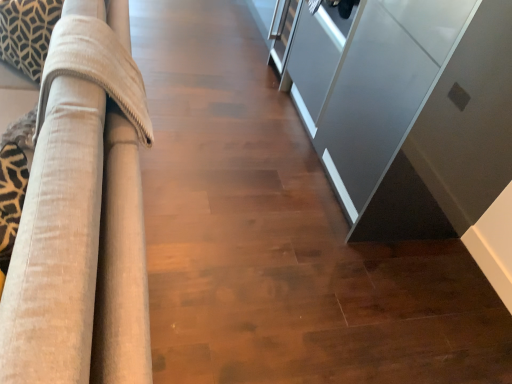
Question: Is patterned fabric pillow at upper left in front of or behind beige fabric couch at left in the image?

Choices:
 (A) front
 (B) behind

Answer: (B)

Question: Would you say patterned fabric pillow at upper left is to the left or to the right of beige fabric couch at left in the picture?

Choices:
 (A) left
 (B) right

Answer: (A)

Question: Considering the real-world distances, which object is farthest from the patterned fabric pillow at upper left?

Choices:
 (A) beige fabric couch at left
 (B) satin gray cabinet at right

Answer: (B)

Question: Which object is positioned closest to the satin gray cabinet at right?

Choices:
 (A) beige fabric couch at left
 (B) patterned fabric pillow at upper left

Answer: (A)